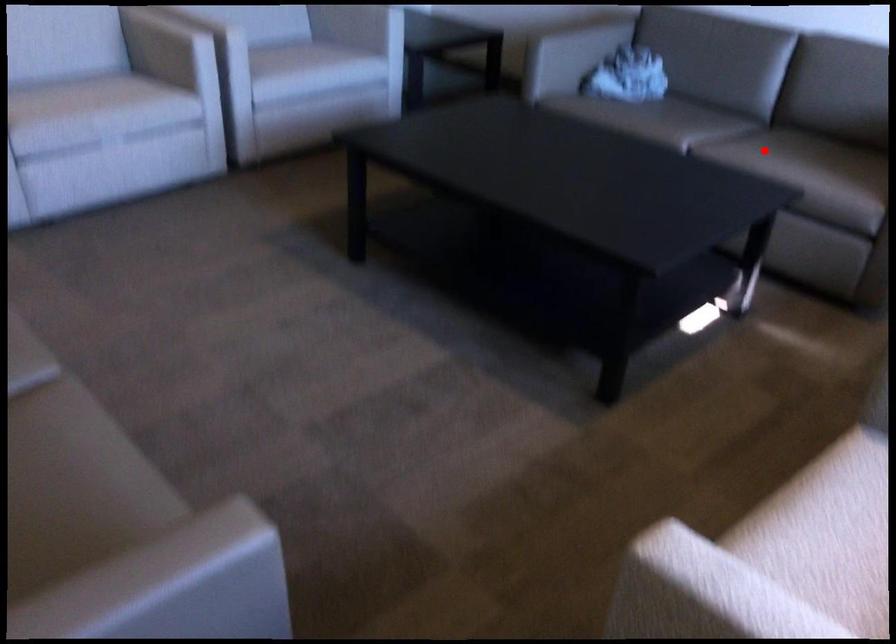
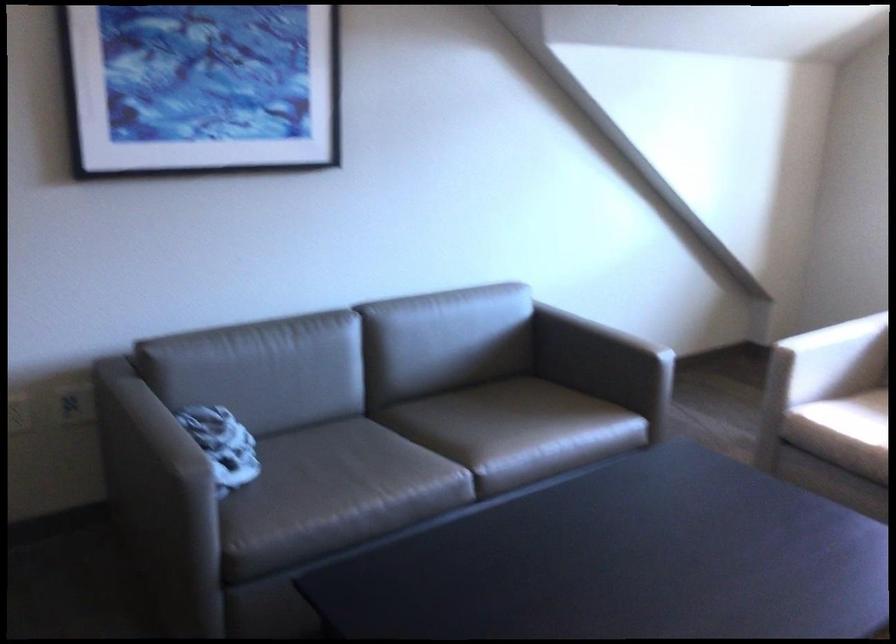
Question: I am providing you with two images of the same scene from different viewpoints. A red point is shown in image1. For the corresponding object point in image2, is it positioned nearer or farther from the camera?

Choices:
 (A) Nearer
 (B) Farther

Answer: (A)